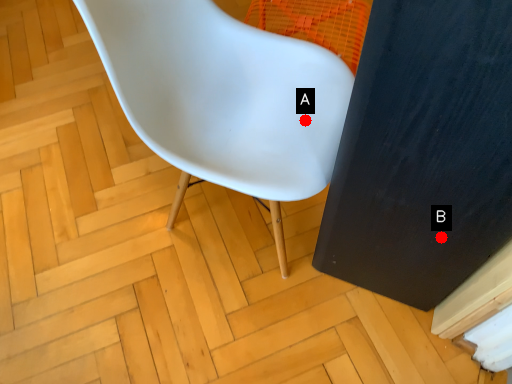
Question: Two points are circled on the image, labeled by A and B beside each circle. Among these points, which one is nearest to the camera?

Choices:
 (A) A is closer
 (B) B is closer

Answer: (B)